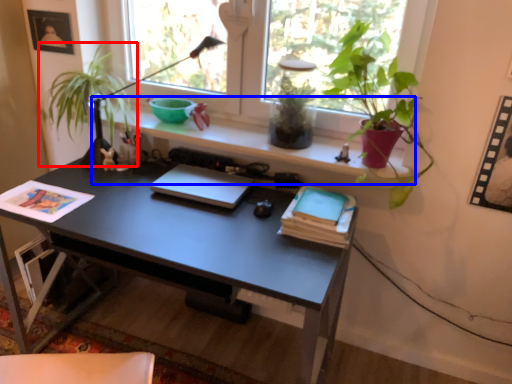
Question: Among these objects, which one is nearest to the camera, plant (highlighted by a red box) or window sill (highlighted by a blue box)?

Choices:
 (A) plant
 (B) window sill

Answer: (B)